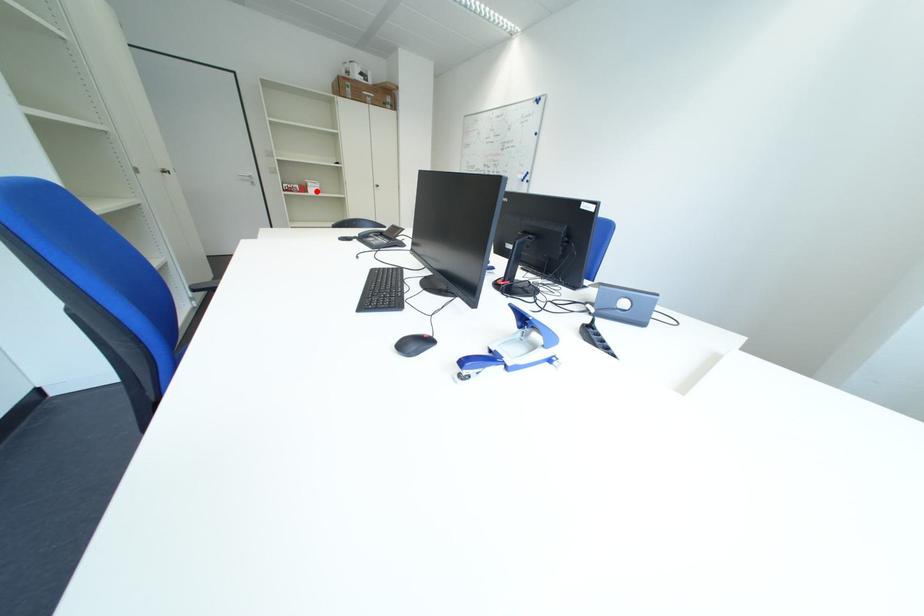
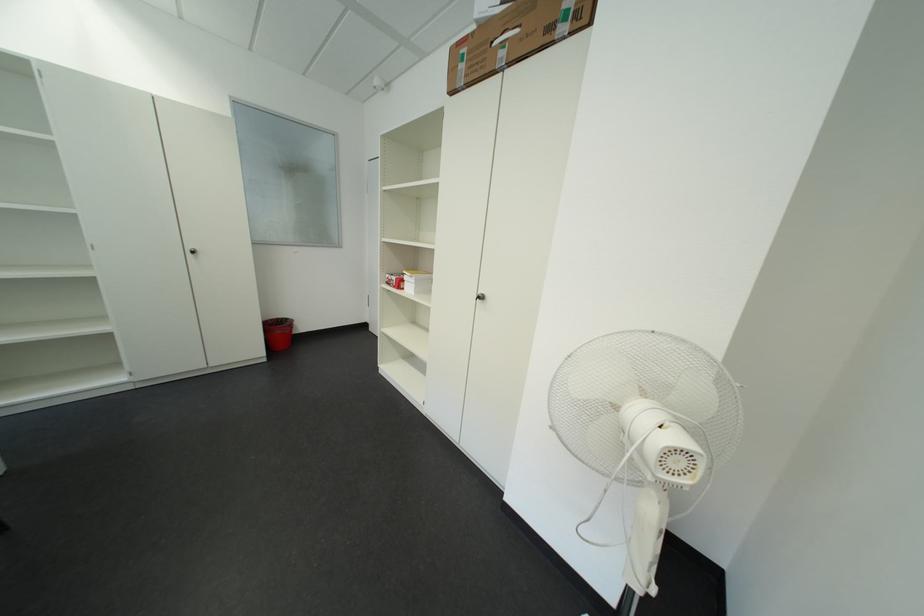
Question: I am providing you with two images of the same scene from different viewpoints. In image1, a red point is highlighted. Considering the same 3D point in image2, which of the following is correct?

Choices:
 (A) It is closer
 (B) It is farther

Answer: (B)